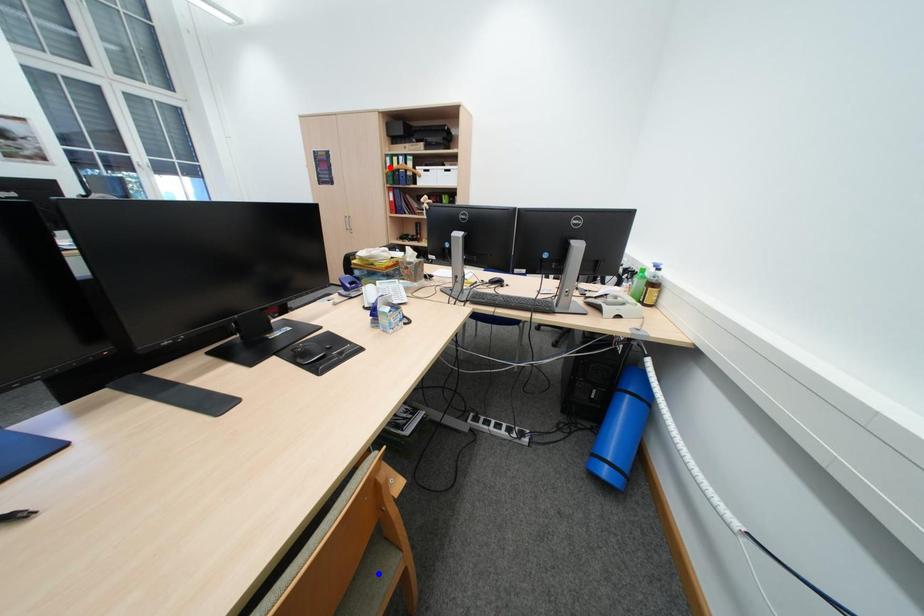
Question: Two points are marked on the image. Which point is closer to the camera?

Choices:
 (A) Blue point is closer.
 (B) Red point is closer.

Answer: (A)